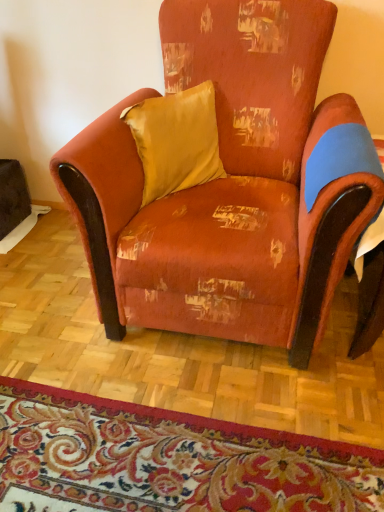
Question: Is floral carpet at lower center positioned far away from distressed orange fabric armchair at center?

Choices:
 (A) yes
 (B) no

Answer: (B)

Question: Is floral carpet at lower center at the left side of distressed orange fabric armchair at center?

Choices:
 (A) no
 (B) yes

Answer: (B)

Question: From a real-world perspective, is floral carpet at lower center over distressed orange fabric armchair at center?

Choices:
 (A) yes
 (B) no

Answer: (B)

Question: Does floral carpet at lower center have a lesser width compared to distressed orange fabric armchair at center?

Choices:
 (A) no
 (B) yes

Answer: (A)

Question: Does floral carpet at lower center come in front of distressed orange fabric armchair at center?

Choices:
 (A) no
 (B) yes

Answer: (A)

Question: Is distressed orange fabric armchair at center taller or shorter than satin yellow pillow at upper center?

Choices:
 (A) short
 (B) tall

Answer: (B)

Question: Is distressed orange fabric armchair at center to the left or to the right of satin yellow pillow at upper center in the image?

Choices:
 (A) right
 (B) left

Answer: (A)

Question: Is distressed orange fabric armchair at center inside the boundaries of satin yellow pillow at upper center, or outside?

Choices:
 (A) inside
 (B) outside

Answer: (B)

Question: Is distressed orange fabric armchair at center wider or thinner than satin yellow pillow at upper center?

Choices:
 (A) wide
 (B) thin

Answer: (A)

Question: Based on their sizes in the image, would you say satin yellow pillow at upper center is bigger or smaller than floral carpet at lower center?

Choices:
 (A) big
 (B) small

Answer: (A)

Question: Is satin yellow pillow at upper center situated inside floral carpet at lower center or outside?

Choices:
 (A) outside
 (B) inside

Answer: (A)

Question: From a real-world perspective, relative to floral carpet at lower center, is satin yellow pillow at upper center vertically above or below?

Choices:
 (A) above
 (B) below

Answer: (A)

Question: Looking at their shapes, would you say satin yellow pillow at upper center is wider or thinner than floral carpet at lower center?

Choices:
 (A) wide
 (B) thin

Answer: (B)

Question: From a real-world perspective, relative to floral carpet at lower center, is distressed orange fabric armchair at center vertically above or below?

Choices:
 (A) above
 (B) below

Answer: (A)

Question: Relative to floral carpet at lower center, is distressed orange fabric armchair at center in front or behind?

Choices:
 (A) behind
 (B) front

Answer: (B)